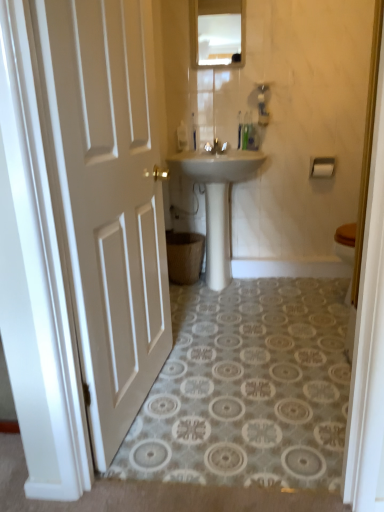
Question: Can we say glossy glass mirror at upper center lies outside white glossy sink at center?

Choices:
 (A) no
 (B) yes

Answer: (B)

Question: Does glossy glass mirror at upper center have a smaller size compared to white glossy sink at center?

Choices:
 (A) yes
 (B) no

Answer: (A)

Question: Considering the relative positions of glossy glass mirror at upper center and white glossy sink at center in the image provided, is glossy glass mirror at upper center to the right of white glossy sink at center from the viewer's perspective?

Choices:
 (A) yes
 (B) no

Answer: (B)

Question: Is the position of glossy glass mirror at upper center less distant than that of white glossy sink at center?

Choices:
 (A) yes
 (B) no

Answer: (B)

Question: Is glossy glass mirror at upper center facing towards white glossy sink at center?

Choices:
 (A) no
 (B) yes

Answer: (A)

Question: Considering the relative sizes of glossy glass mirror at upper center and white glossy sink at center in the image provided, is glossy glass mirror at upper center thinner than white glossy sink at center?

Choices:
 (A) yes
 (B) no

Answer: (A)

Question: Is matte white faucet at center far from glossy glass mirror at upper center?

Choices:
 (A) no
 (B) yes

Answer: (A)

Question: Considering the relative sizes of matte white faucet at center and glossy glass mirror at upper center in the image provided, is matte white faucet at center wider than glossy glass mirror at upper center?

Choices:
 (A) no
 (B) yes

Answer: (B)

Question: Is matte white faucet at center next to glossy glass mirror at upper center?

Choices:
 (A) yes
 (B) no

Answer: (B)

Question: Can you confirm if matte white faucet at center is positioned to the left of glossy glass mirror at upper center?

Choices:
 (A) no
 (B) yes

Answer: (B)

Question: Could glossy glass mirror at upper center be considered to be inside matte white faucet at center?

Choices:
 (A) no
 (B) yes

Answer: (A)

Question: Is the depth of matte white faucet at center greater than that of glossy glass mirror at upper center?

Choices:
 (A) no
 (B) yes

Answer: (B)

Question: Considering the relative sizes of white matte door at left and glossy glass mirror at upper center in the image provided, is white matte door at left wider than glossy glass mirror at upper center?

Choices:
 (A) yes
 (B) no

Answer: (A)